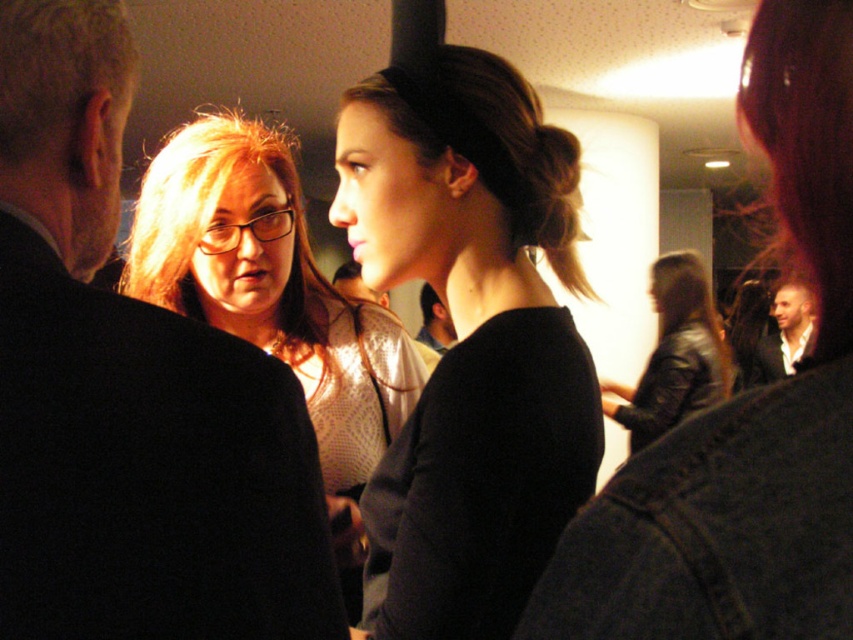
Question: Estimate the real-world distances between objects in this image. Which object is closer to the matte black sweater at center?

Choices:
 (A) black suit at left
 (B) white shirt at right

Answer: (A)

Question: Is black suit at left to the right of matte black sweater at center from the viewer's perspective?

Choices:
 (A) yes
 (B) no

Answer: (A)

Question: Which point appears farthest from the camera in this image?

Choices:
 (A) (683, 362)
 (B) (303, 234)

Answer: (A)

Question: Is matte black sweater at center bigger than leather jacket at right?

Choices:
 (A) no
 (B) yes

Answer: (A)

Question: Can you confirm if black matte shirt at center is smaller than white shirt at center?

Choices:
 (A) yes
 (B) no

Answer: (B)

Question: Which point is closer to the camera?

Choices:
 (A) white shirt at right
 (B) matte black sweater at center
 (C) black leather jacket at lower right

Answer: (B)